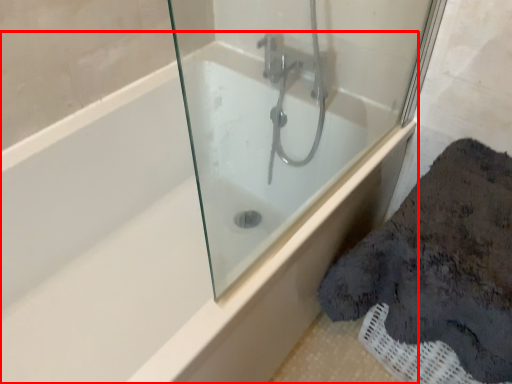
Question: From the image's perspective, what is the correct spatial positioning of bathtub (annotated by the red box) in reference to bath?

Choices:
 (A) above
 (B) below

Answer: (B)